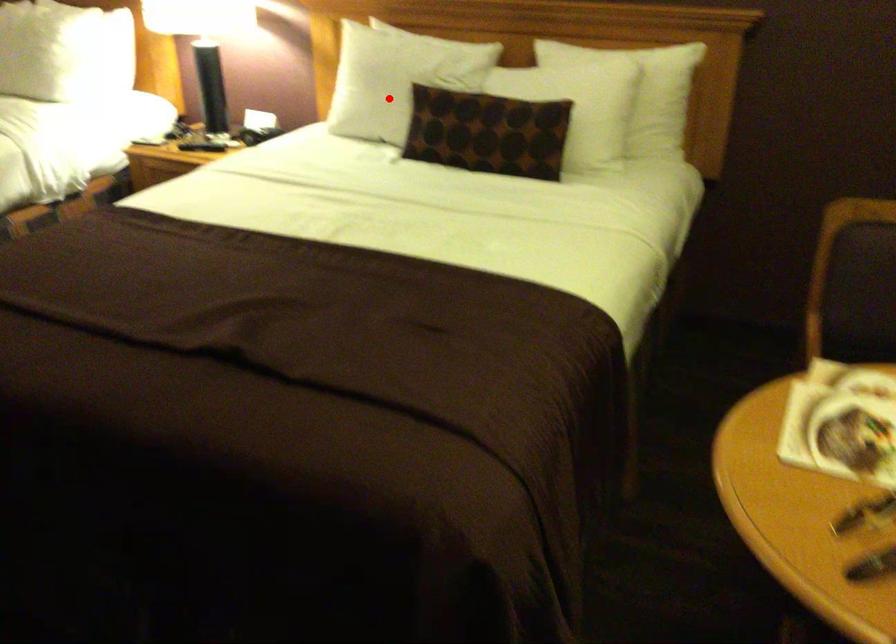
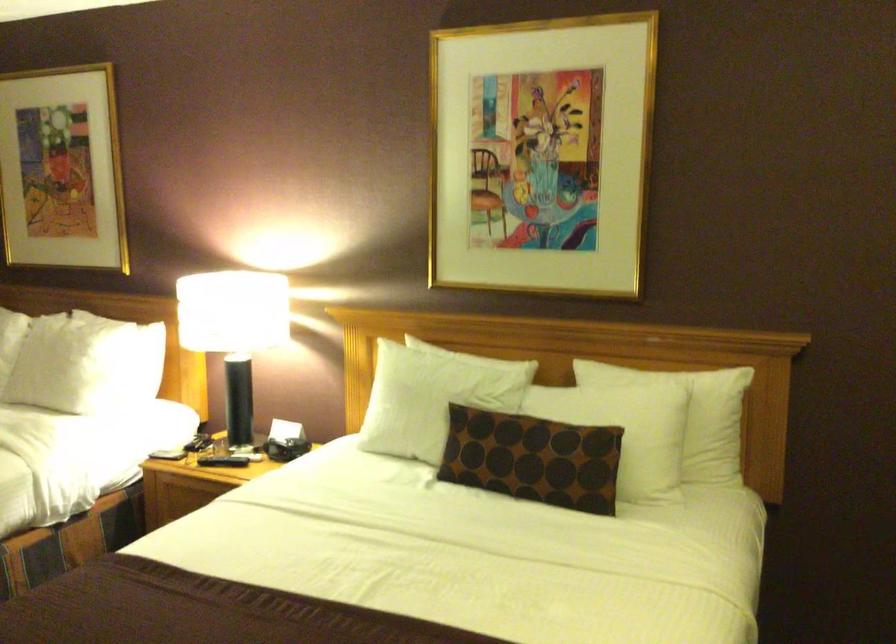
Find the pixel in the second image that matches the highlighted location in the first image.

(424, 418)